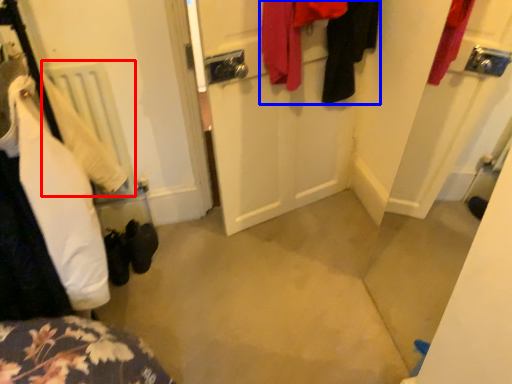
Question: Which object appears farthest to the camera in this image, radiator (highlighted by a red box) or clothing (highlighted by a blue box)?

Choices:
 (A) radiator
 (B) clothing

Answer: (A)